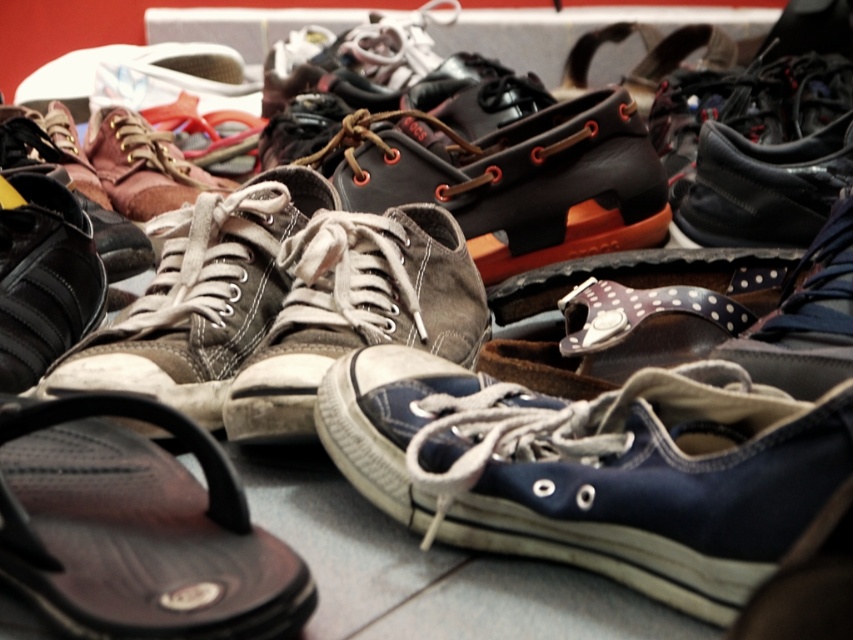
Is black rubber flip-flop at lower left shorter than worn canvas sneaker at center?

Correct, black rubber flip-flop at lower left is not as tall as worn canvas sneaker at center.

Is black rubber flip-flop at lower left to the right of worn canvas sneaker at center from the viewer's perspective?

No, black rubber flip-flop at lower left is not to the right of worn canvas sneaker at center.

Which is behind, point (244, 621) or point (300, 417)?

Positioned behind is point (300, 417).

Identify the location of black rubber flip-flop at lower left. (136, 528).

Based on the photo, is worn canvas sneaker at center above brown suede sneaker at center-left?

No.

Is worn canvas sneaker at center smaller than brown suede sneaker at center-left?

Indeed, worn canvas sneaker at center has a smaller size compared to brown suede sneaker at center-left.

The width and height of the screenshot is (853, 640). What do you see at coordinates (357, 308) in the screenshot?
I see `worn canvas sneaker at center` at bounding box center [357, 308].

Image resolution: width=853 pixels, height=640 pixels. Find the location of `worn canvas sneaker at center`. worn canvas sneaker at center is located at coordinates (357, 308).

The image size is (853, 640). What do you see at coordinates (593, 467) in the screenshot?
I see `navy canvas sneaker at center` at bounding box center [593, 467].

Is navy canvas sneaker at center bigger than black rubber flip-flop at lower left?

Indeed, navy canvas sneaker at center has a larger size compared to black rubber flip-flop at lower left.

Locate an element on the screen. The height and width of the screenshot is (640, 853). navy canvas sneaker at center is located at coordinates (593, 467).